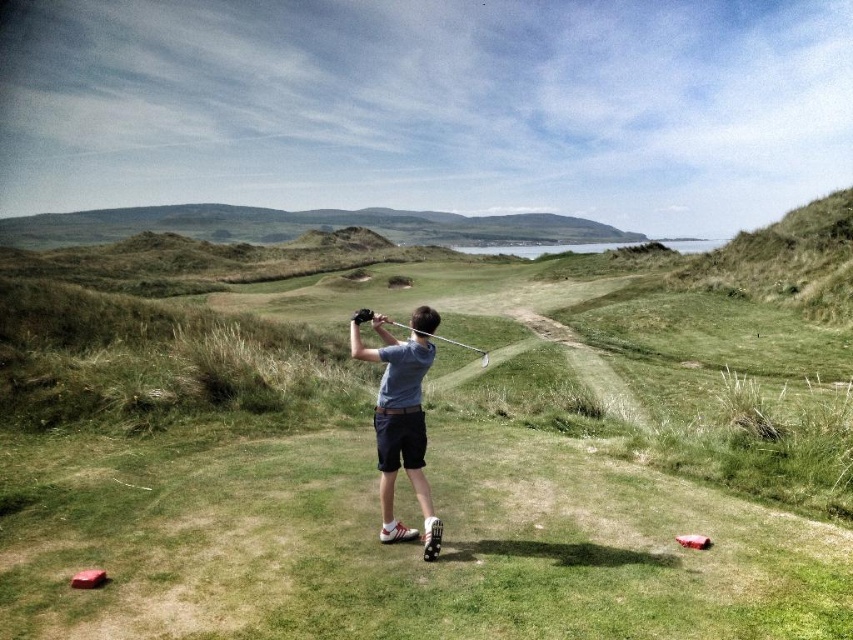
Is gray cotton shirt at center below metallic silver golf club at center?

Yes.

In the scene shown: Does gray cotton shirt at center appear on the left side of metallic silver golf club at center?

Incorrect, gray cotton shirt at center is not on the left side of metallic silver golf club at center.

In order to click on gray cotton shirt at center in this screenshot , I will do `click(401, 419)`.

Where is `gray cotton shirt at center`? This screenshot has width=853, height=640. gray cotton shirt at center is located at coordinates (401, 419).